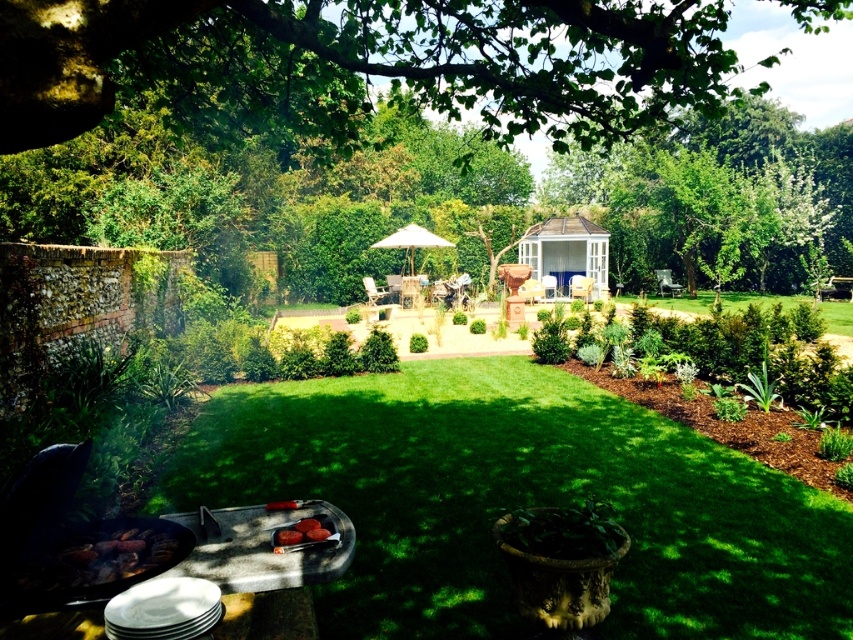
Is point (68, 627) positioned in front of point (659, 289)?

That is True.

This screenshot has width=853, height=640. Find the location of `smooth metal grill at lower left`. smooth metal grill at lower left is located at coordinates (264, 564).

Where is `smooth metal grill at lower left`? This screenshot has height=640, width=853. smooth metal grill at lower left is located at coordinates (264, 564).

What are the coordinates of `green leafy tree at upper center` in the screenshot? It's located at (396, 58).

The height and width of the screenshot is (640, 853). Describe the element at coordinates (396, 58) in the screenshot. I see `green leafy tree at upper center` at that location.

This screenshot has width=853, height=640. I want to click on green leafy tree at upper center, so click(396, 58).

Does charcoal briquettes at lower left have a smaller size compared to white fabric umbrella at center?

No.

Can you confirm if charcoal briquettes at lower left is positioned above white fabric umbrella at center?

No, charcoal briquettes at lower left is not above white fabric umbrella at center.

Which is behind, point (86, 531) or point (439, 237)?

Positioned behind is point (439, 237).

Where is `charcoal briquettes at lower left`? The image size is (853, 640). charcoal briquettes at lower left is located at coordinates (106, 556).